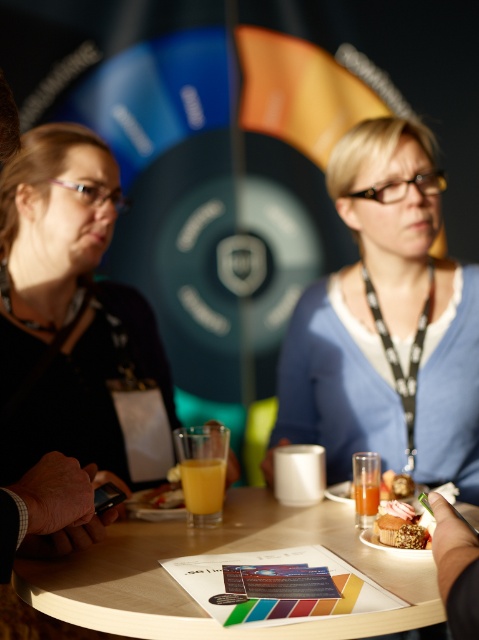
You are at a networking event and need to place a 10cm wide notebook between the translucent glass of orange juice at table center and the golden textured muffin at lower center. Considering their sizes, will there be enough space?

The translucent glass of orange juice at table center is larger than the golden textured muffin at lower center. Since the notebook is 10cm wide, there might not be enough space between them if the combined width of the glass and muffin exceeds 10cm. However, without exact measurements, it is uncertain.

You are standing at the edge of the room and see the matte black shirt at left and the wooden table at center. Which object is closer to the left side of the room?

The matte black shirt at left is closer to the left side of the room because it is positioned to the left of the wooden table at center.